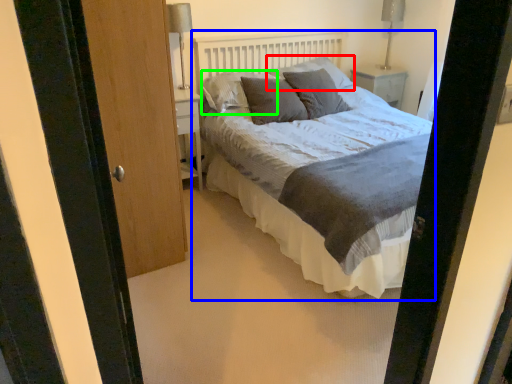
Question: Considering the real-world distances, which object is closest to pillow (highlighted by a red box)? bed (highlighted by a blue box) or pillow (highlighted by a green box).

Choices:
 (A) bed
 (B) pillow

Answer: (B)